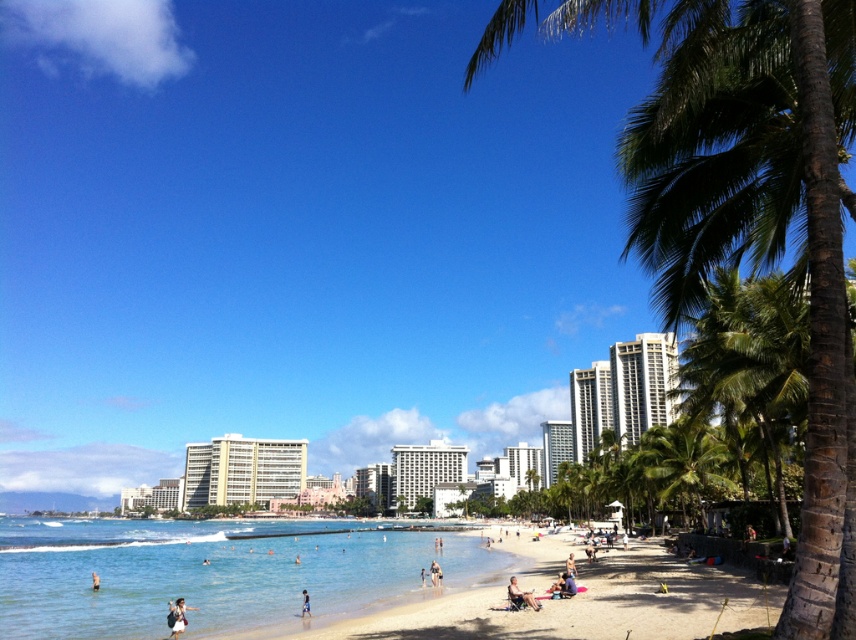
Question: Which object appears closest to the camera in this image?

Choices:
 (A) green leafy palm tree at right
 (B) light blue fabric at lower left

Answer: (A)

Question: Can you confirm if white glossy hotel at center is thinner than smooth tan skin at lower center?

Choices:
 (A) no
 (B) yes

Answer: (A)

Question: Can you confirm if beige concrete building at center is positioned above green leafy palm tree at center-right?

Choices:
 (A) no
 (B) yes

Answer: (A)

Question: Can you confirm if green leafy palm tree at center-right is wider than light blue fabric at beach center?

Choices:
 (A) yes
 (B) no

Answer: (A)

Question: Which object is positioned closest to the light blue fabric at beach center?

Choices:
 (A) white glossy hotel at center
 (B) green leafy palm tree at right

Answer: (B)

Question: Estimate the real-world distances between objects in this image. Which object is farther from the light blue fabric at beach center?

Choices:
 (A) white cotton shirt at lower left
 (B) beige concrete building at center
 (C) white glossy hotel at center

Answer: (B)